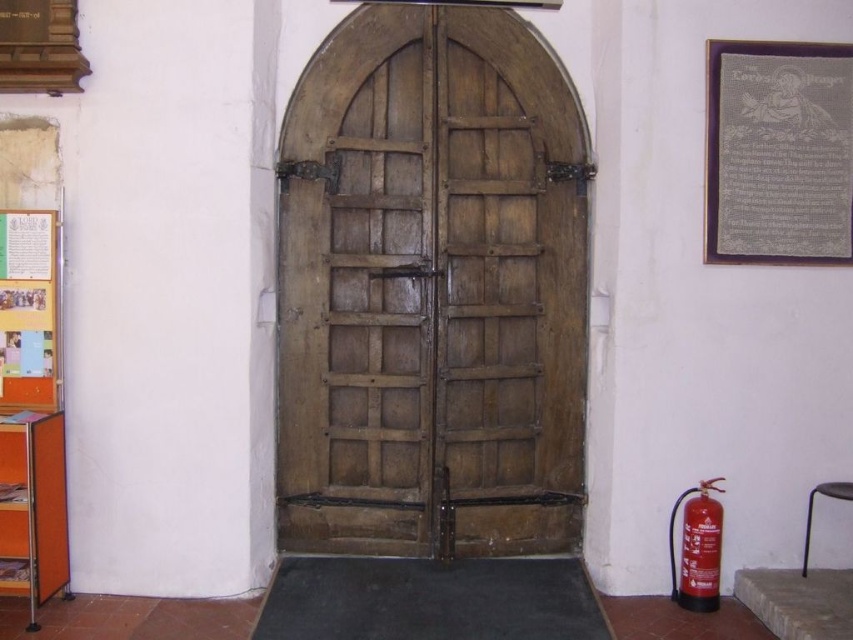
Question: Considering the real-world distances, which object is farthest from the wooden door at center?

Choices:
 (A) red matte fire extinguisher at lower right
 (B) metallic gray stool at lower right

Answer: (B)

Question: Is silver metallic plaque at upper right closer to the viewer compared to red matte fire extinguisher at lower right?

Choices:
 (A) no
 (B) yes

Answer: (A)

Question: Does wooden door at center appear over silver metallic plaque at upper right?

Choices:
 (A) no
 (B) yes

Answer: (A)

Question: Which of these objects is positioned farthest from the red matte fire extinguisher at lower right?

Choices:
 (A) wooden door at center
 (B) multicolored paper at left
 (C) metallic gray stool at lower right

Answer: (B)

Question: Which point is farther to the camera?

Choices:
 (A) silver metallic plaque at upper right
 (B) multicolored paper at left
 (C) wooden door at center

Answer: (C)

Question: Can you confirm if wooden door at center is positioned below multicolored paper at left?

Choices:
 (A) no
 (B) yes

Answer: (A)